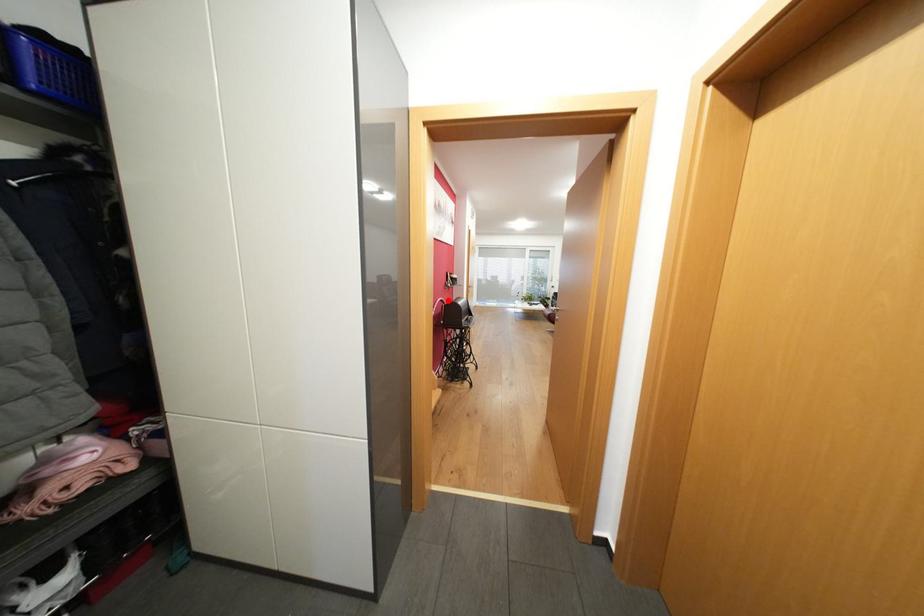
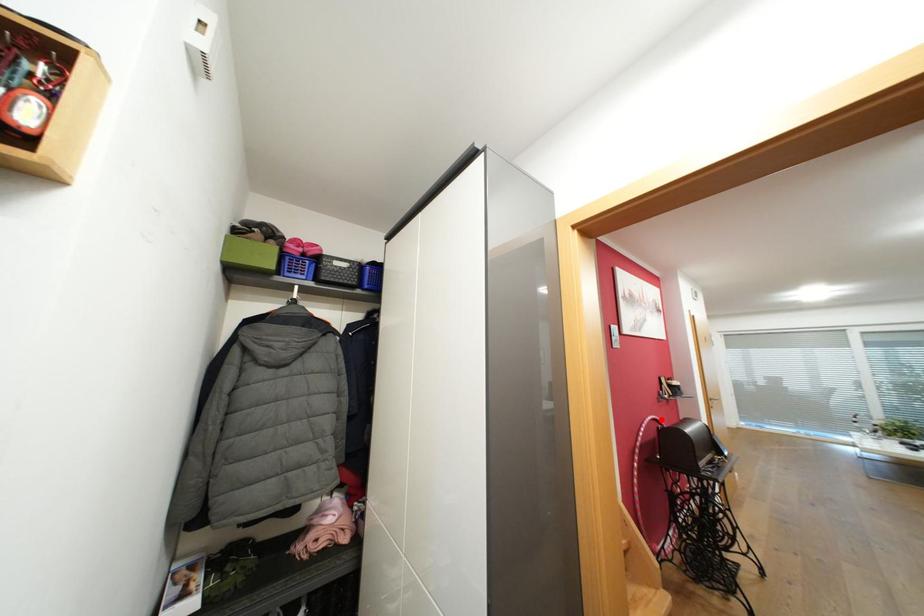
I am providing you with two images of the same scene from different viewpoints. A red point is marked on the first image and another point is marked on the second image. Are the points marked in image1 and image2 representing the same 3D position?

Yes